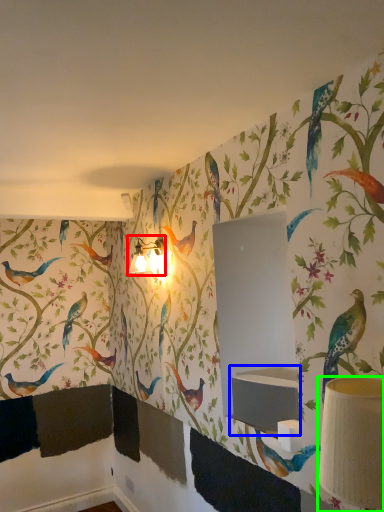
Question: Considering the real-world distances, which object is farthest from table lamp (highlighted by a red box)? sink (highlighted by a blue box) or table lamp (highlighted by a green box)?

Choices:
 (A) sink
 (B) table lamp

Answer: (B)